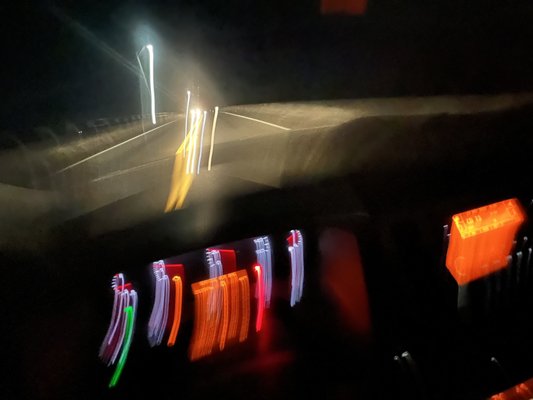
Locate an element on the screen. This screenshot has width=533, height=400. radio is located at coordinates coord(492,213).